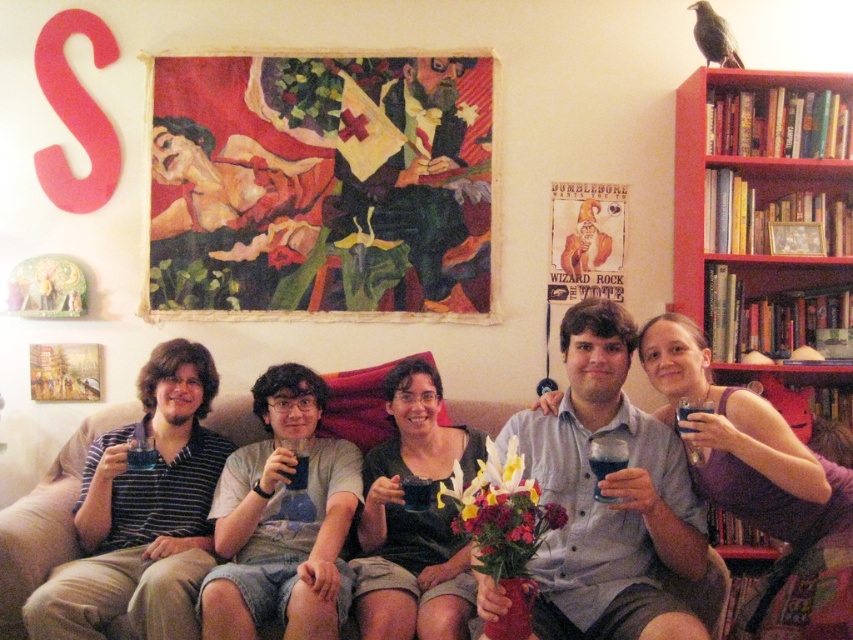
Between matte purple tank top at center and red wood bookshelf at upper right, which one is positioned lower?

matte purple tank top at center

This screenshot has width=853, height=640. Describe the element at coordinates (744, 444) in the screenshot. I see `matte purple tank top at center` at that location.

Find the location of a particular element. Image resolution: width=853 pixels, height=640 pixels. matte purple tank top at center is located at coordinates point(744,444).

Between gray cotton t-shirt at center and red wood bookshelf at upper right, which one appears on the right side from the viewer's perspective?

red wood bookshelf at upper right is more to the right.

In order to click on gray cotton t-shirt at center in this screenshot , I will do `click(282, 520)`.

Between point (343, 468) and point (769, 77), which one is positioned in front?

Point (343, 468)

The height and width of the screenshot is (640, 853). I want to click on gray cotton t-shirt at center, so click(282, 520).

Image resolution: width=853 pixels, height=640 pixels. What do you see at coordinates (689, 412) in the screenshot?
I see `clear plastic cup at center` at bounding box center [689, 412].

Is clear plastic cup at center smaller than translucent plastic cup at center?

No, clear plastic cup at center is not smaller than translucent plastic cup at center.

Locate an element on the screen. The image size is (853, 640). clear plastic cup at center is located at coordinates (689, 412).

Locate an element on the screen. clear plastic cup at center is located at coordinates (689, 412).